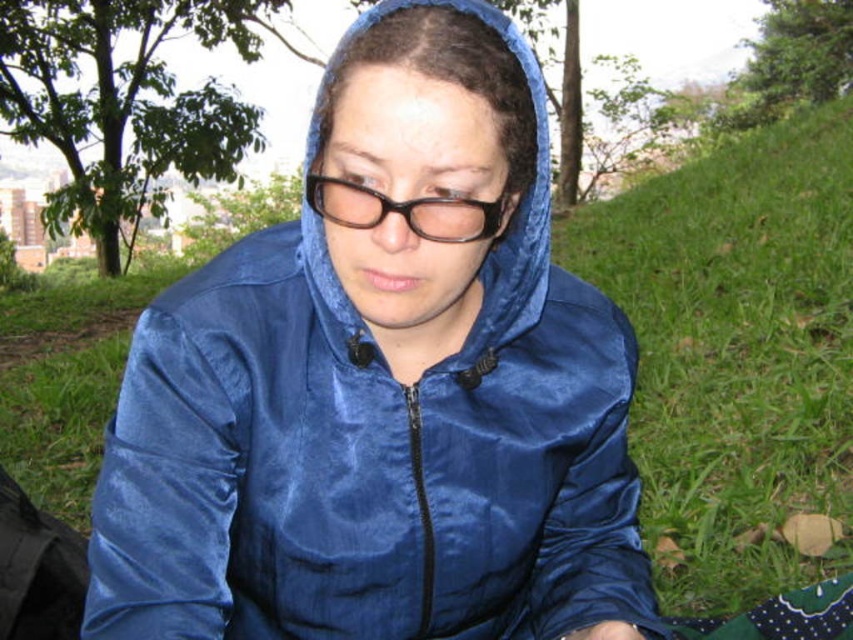
Who is higher up, satin blue jacket at center or green grass at lower right?

Positioned higher is green grass at lower right.

Between satin blue jacket at center and green grass at lower right, which one appears on the left side from the viewer's perspective?

satin blue jacket at center is more to the left.

Where is `satin blue jacket at center`? This screenshot has height=640, width=853. satin blue jacket at center is located at coordinates (383, 390).

Is green grass at lower right to the right of blue fabric hood at center from the viewer's perspective?

Yes, green grass at lower right is to the right of blue fabric hood at center.

Does green grass at lower right have a lesser height compared to blue fabric hood at center?

Yes.

Does point (657, 202) come behind point (335, 112)?

That is True.

The height and width of the screenshot is (640, 853). I want to click on green grass at lower right, so click(735, 352).

Is satin blue jacket at center to the right of blue fabric hood at center from the viewer's perspective?

Incorrect, satin blue jacket at center is not on the right side of blue fabric hood at center.

Identify the location of satin blue jacket at center. click(x=383, y=390).